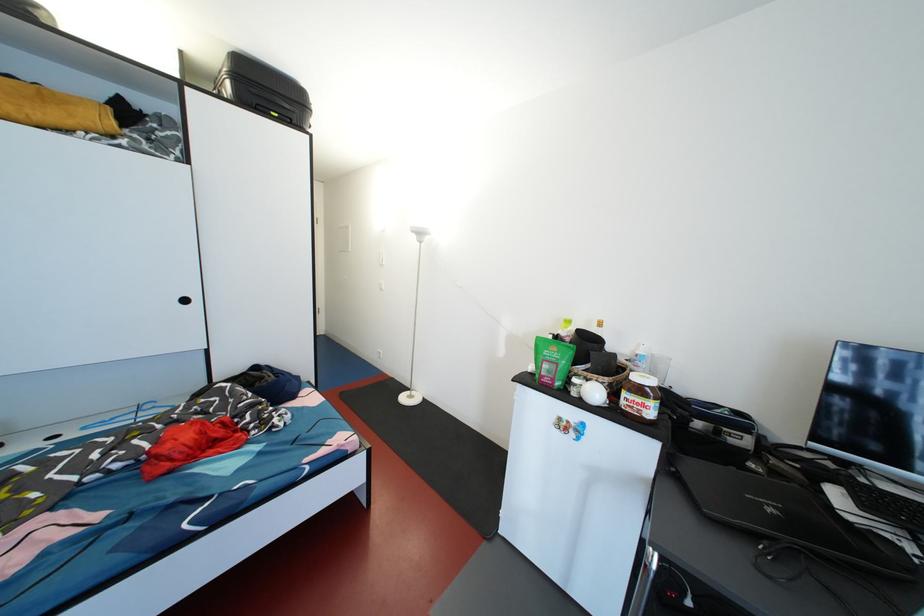
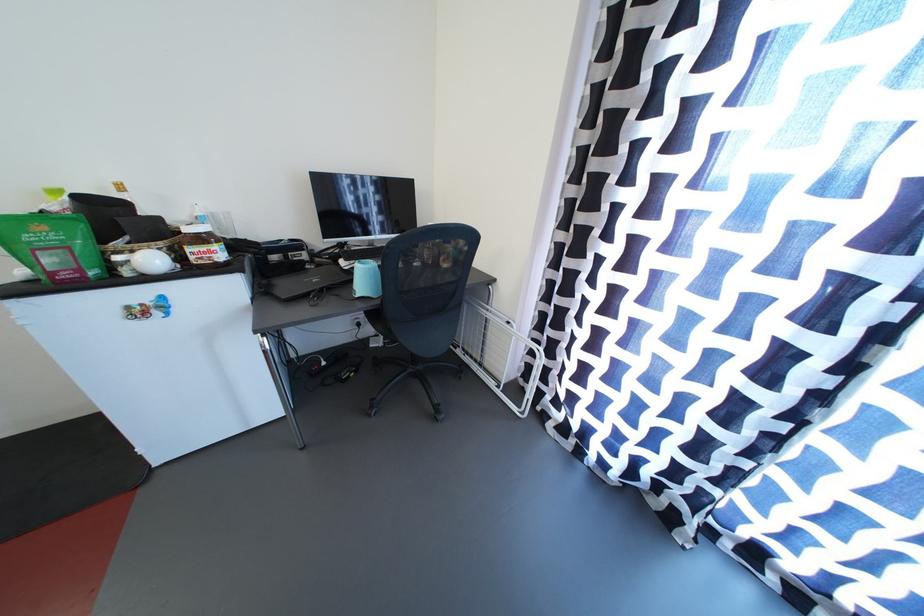
In the second image, find the point that corresponds to the point at 564,370 in the first image.

(75, 253)